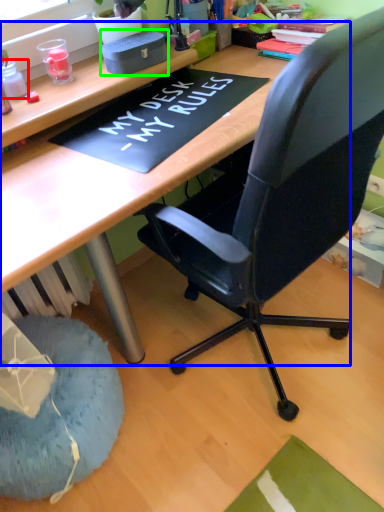
Question: Which object is the farthest from stationery (highlighted by a red box)? Choose among these: computer desk (highlighted by a blue box) or stationery (highlighted by a green box).

Choices:
 (A) computer desk
 (B) stationery

Answer: (A)